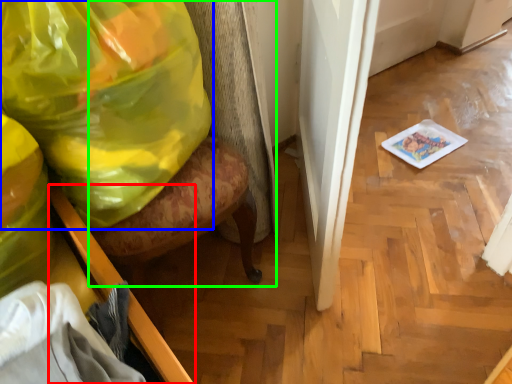
Question: Which object is the farthest from furniture (highlighted by a red box)? Choose among these: plastic bag (highlighted by a blue box) or swivel chair (highlighted by a green box).

Choices:
 (A) plastic bag
 (B) swivel chair

Answer: (B)